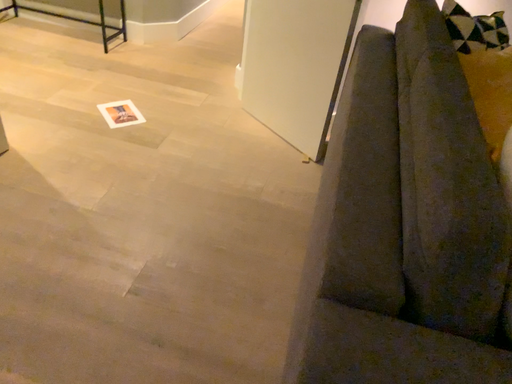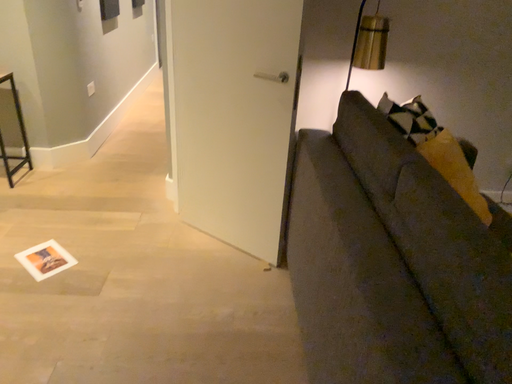
Question: Which way did the camera rotate in the video?

Choices:
 (A) rotated right
 (B) rotated left

Answer: (A)